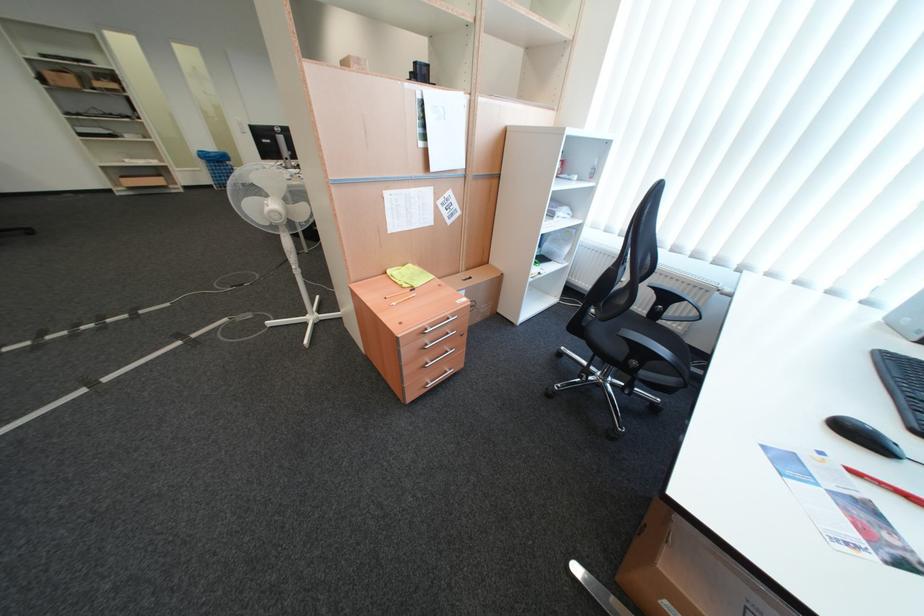
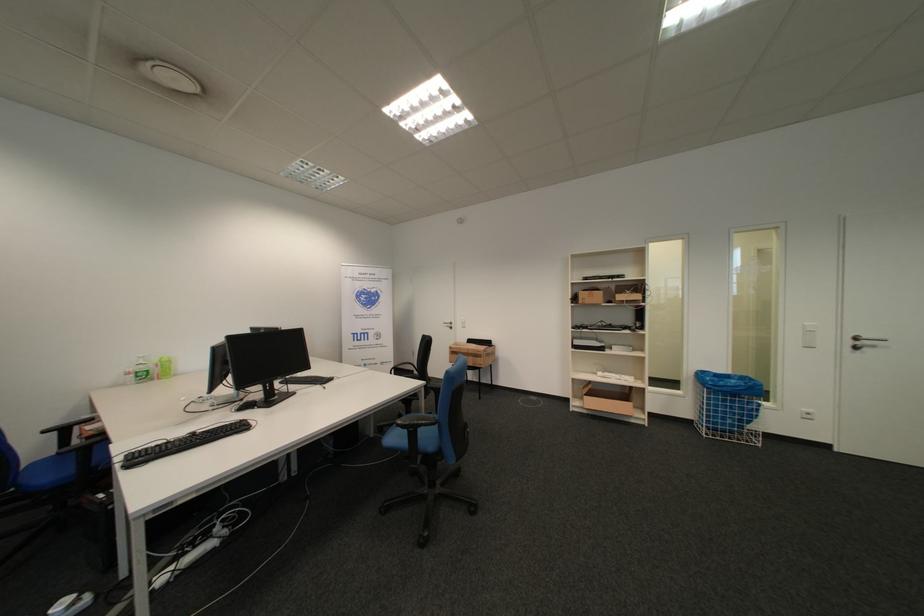
Find the pixel in the second image that matches (x=136, y=177) in the first image.

(601, 395)